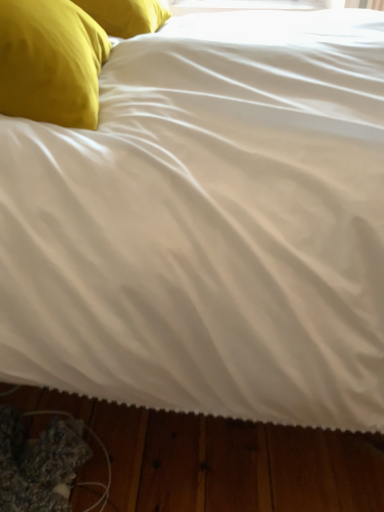
Question: From a real-world perspective, relative to matte yellow pillow at upper left, the second pillow in the bottom-to-top sequence, is yellow fabric pillow at upper left, the 2th pillow in the top-to-bottom sequence, vertically above or below?

Choices:
 (A) below
 (B) above

Answer: (B)

Question: Considering the positions of point (96, 56) and point (102, 3), is point (96, 56) closer or farther from the camera than point (102, 3)?

Choices:
 (A) closer
 (B) farther

Answer: (A)

Question: Considering the positions of yellow fabric pillow at upper left, marked as the 1th pillow in a bottom-to-top arrangement, and matte yellow pillow at upper left, which appears as the 2th pillow when viewed from the front, in the image, is yellow fabric pillow at upper left, marked as the 1th pillow in a bottom-to-top arrangement, wider or thinner than matte yellow pillow at upper left, which appears as the 2th pillow when viewed from the front,?

Choices:
 (A) wide
 (B) thin

Answer: (B)

Question: Is matte yellow pillow at upper left, the second pillow in the bottom-to-top sequence, taller or shorter than yellow fabric pillow at upper left, which ranks as the 2th pillow in back-to-front order?

Choices:
 (A) tall
 (B) short

Answer: (B)

Question: Considering their positions, is matte yellow pillow at upper left, which appears as the 1th pillow when viewed from the top, located in front of or behind yellow fabric pillow at upper left, the 2th pillow in the top-to-bottom sequence?

Choices:
 (A) front
 (B) behind

Answer: (B)

Question: In terms of width, does matte yellow pillow at upper left, the first pillow positioned from the back, look wider or thinner when compared to yellow fabric pillow at upper left, which ranks as the 2th pillow in back-to-front order?

Choices:
 (A) wide
 (B) thin

Answer: (A)

Question: Considering the positions of matte yellow pillow at upper left, the first pillow positioned from the back, and yellow fabric pillow at upper left, the 1th pillow positioned from the front, in the image, is matte yellow pillow at upper left, the first pillow positioned from the back, bigger or smaller than yellow fabric pillow at upper left, the 1th pillow positioned from the front,?

Choices:
 (A) big
 (B) small

Answer: (B)